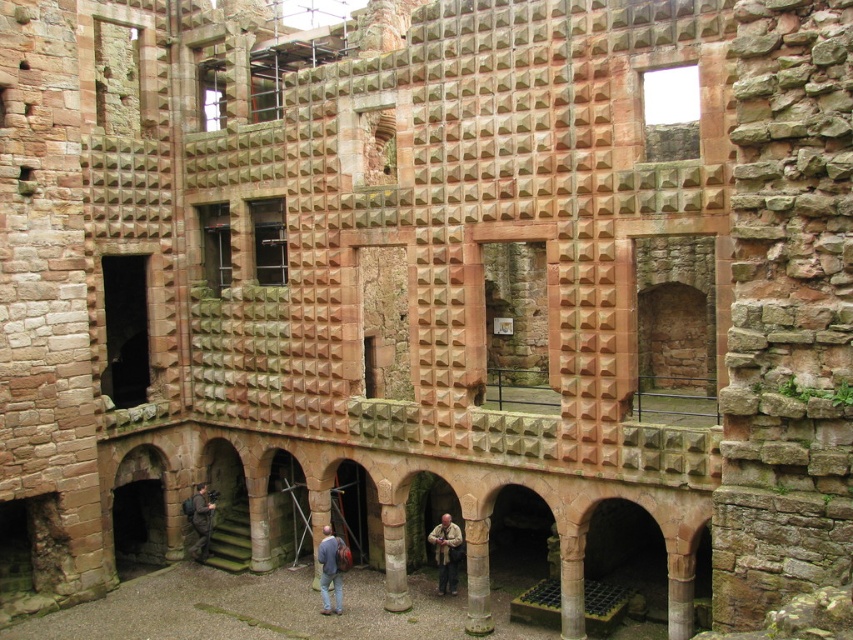
You are a visitor exploring the castle and notice the smooth stone column at center and the brown textured jacket at lower center. Which object is located closer to the ground?

The smooth stone column at center is positioned under the brown textured jacket at lower center, so it is closer to the ground.